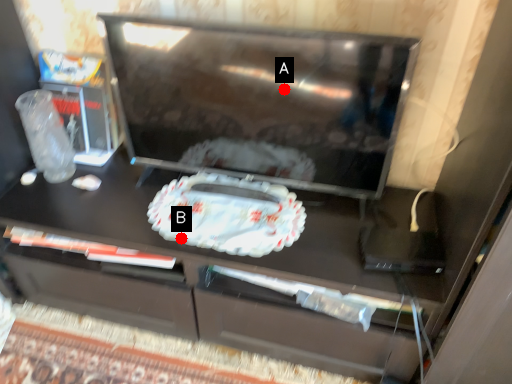
Question: Two points are circled on the image, labeled by A and B beside each circle. Which point is closer to the camera?

Choices:
 (A) A is closer
 (B) B is closer

Answer: (A)